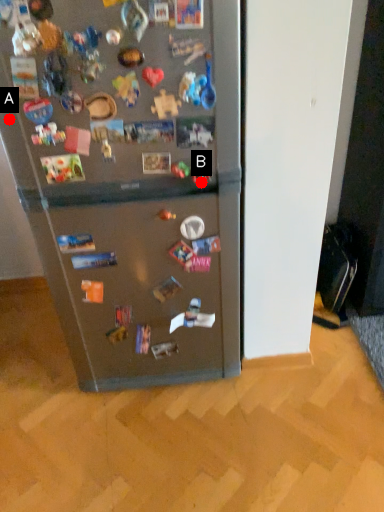
Question: Two points are circled on the image, labeled by A and B beside each circle. Which of the following is the closest to the observer?

Choices:
 (A) A is closer
 (B) B is closer

Answer: (A)